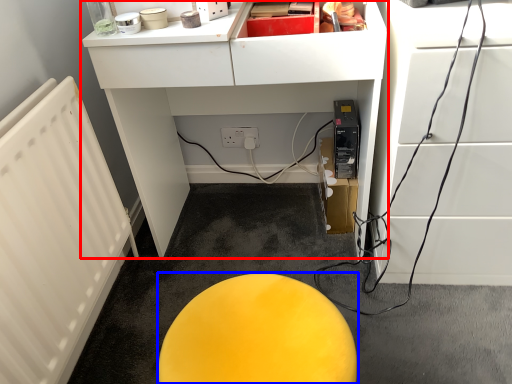
Question: Which of the following is the closest to the observer, furniture (highlighted by a red box) or furniture (highlighted by a blue box)?

Choices:
 (A) furniture
 (B) furniture

Answer: (B)